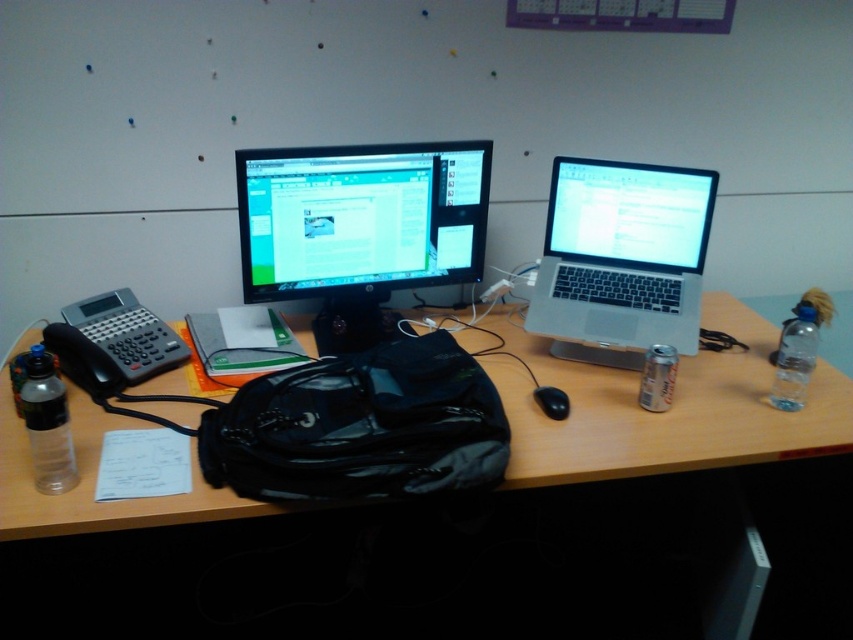
Question: Can you confirm if silver metallic laptop at center is positioned below clear plastic bottle at right?

Choices:
 (A) yes
 (B) no

Answer: (B)

Question: Is transparent plastic bottle at left further to camera compared to clear plastic bottle at right?

Choices:
 (A) yes
 (B) no

Answer: (B)

Question: Which object is the closest to the black matte mouse at center?

Choices:
 (A) matte black monitor at center
 (B) wooden desk at center

Answer: (B)

Question: Observing the image, what is the correct spatial positioning of transparent plastic bottle at left in reference to clear plastic bottle at right?

Choices:
 (A) above
 (B) below

Answer: (B)

Question: Which point appears closest to the camera in this image?

Choices:
 (A) tap(451, 244)
 (B) tap(546, 410)
 (C) tap(718, 419)
 (D) tap(36, 467)

Answer: (D)

Question: Which point is closer to the camera taking this photo?

Choices:
 (A) (746, 388)
 (B) (683, 196)
 (C) (788, 360)

Answer: (C)